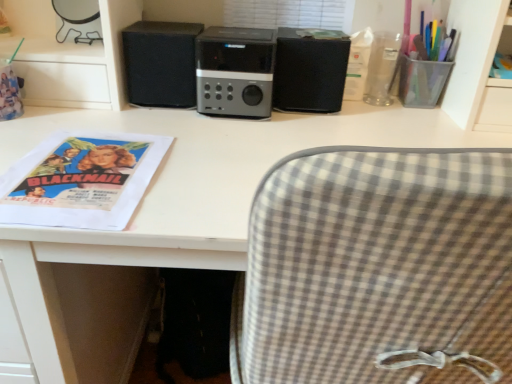
Question: Can you confirm if satin black speaker at center is smaller than matte paper poster at left?

Choices:
 (A) yes
 (B) no

Answer: (B)

Question: Is satin black speaker at center further to the viewer compared to matte paper poster at left?

Choices:
 (A) no
 (B) yes

Answer: (B)

Question: Is satin black speaker at center taller than matte paper poster at left?

Choices:
 (A) no
 (B) yes

Answer: (B)

Question: Can you confirm if satin black speaker at center is positioned to the left of matte paper poster at left?

Choices:
 (A) no
 (B) yes

Answer: (A)

Question: Is satin black speaker at center closer to camera compared to matte paper poster at left?

Choices:
 (A) yes
 (B) no

Answer: (B)

Question: Considering the positions of white matte desk at center and black matte speaker at center, which is the 2th speaker from left to right, in the image, is white matte desk at center taller or shorter than black matte speaker at center, which is the 2th speaker from left to right,?

Choices:
 (A) tall
 (B) short

Answer: (A)

Question: Do you think white matte desk at center is within black matte speaker at center, which is the first speaker in right-to-left order, or outside of it?

Choices:
 (A) inside
 (B) outside

Answer: (B)

Question: From the image's perspective, is white matte desk at center located above or below black matte speaker at center, which is the first speaker in right-to-left order?

Choices:
 (A) below
 (B) above

Answer: (A)

Question: Is point (230, 261) closer or farther from the camera than point (302, 69)?

Choices:
 (A) closer
 (B) farther

Answer: (A)

Question: Is satin black speaker at center taller or shorter than transparent plastic cup at upper right, the 2th stationery when ordered from left to right?

Choices:
 (A) short
 (B) tall

Answer: (B)

Question: Which is correct: satin black speaker at center is inside transparent plastic cup at upper right, which is the 1th stationery from right to left, or outside of it?

Choices:
 (A) outside
 (B) inside

Answer: (A)

Question: Considering the positions of point (198, 87) and point (412, 71), is point (198, 87) closer or farther from the camera than point (412, 71)?

Choices:
 (A) closer
 (B) farther

Answer: (A)

Question: From the image's perspective, is satin black speaker at center located above or below transparent plastic cup at upper right, which is the 1th stationery from right to left?

Choices:
 (A) above
 (B) below

Answer: (A)

Question: Choose the correct answer: Is clear plastic cup at upper right, acting as the first stationery starting from the left, inside matte paper poster at left or outside it?

Choices:
 (A) inside
 (B) outside

Answer: (B)

Question: Considering the positions of clear plastic cup at upper right, the second stationery viewed from the right, and matte paper poster at left in the image, is clear plastic cup at upper right, the second stationery viewed from the right, wider or thinner than matte paper poster at left?

Choices:
 (A) wide
 (B) thin

Answer: (B)